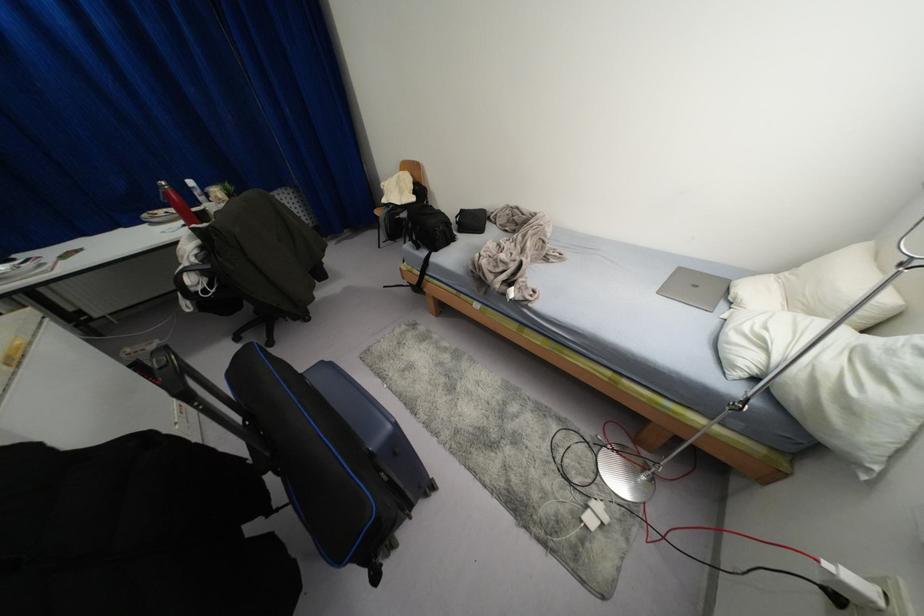
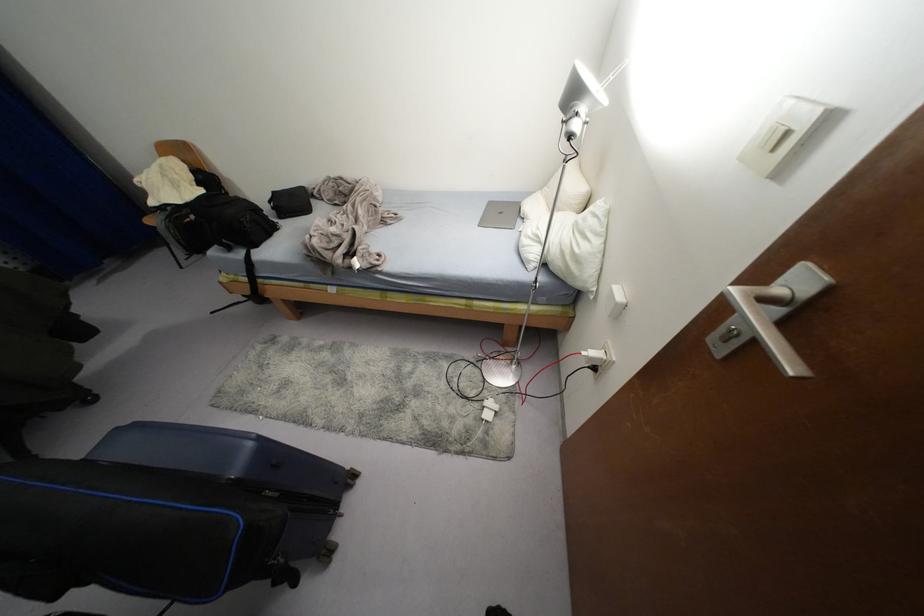
In the second image, find the point that corresponds to the point at 811,379 in the first image.

(561, 251)